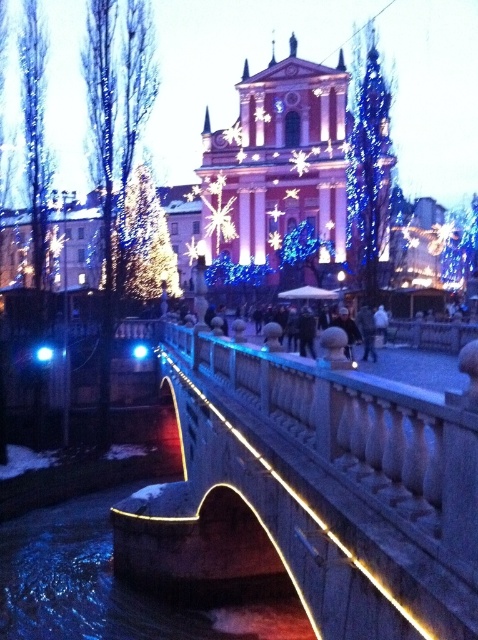
Question: Which of the following is the closest to the observer?

Choices:
 (A) (315, 408)
 (B) (264, 602)

Answer: (A)

Question: Does illuminated stone bridge at center appear on the right side of illuminated water at bridge center?

Choices:
 (A) no
 (B) yes

Answer: (B)

Question: Is illuminated stone bridge at center above illuminated water at bridge center?

Choices:
 (A) yes
 (B) no

Answer: (A)

Question: Can you confirm if illuminated stone bridge at center is wider than illuminated water at bridge center?

Choices:
 (A) no
 (B) yes

Answer: (A)

Question: Which point is closer to the camera?

Choices:
 (A) (245, 605)
 (B) (300, 465)

Answer: (B)